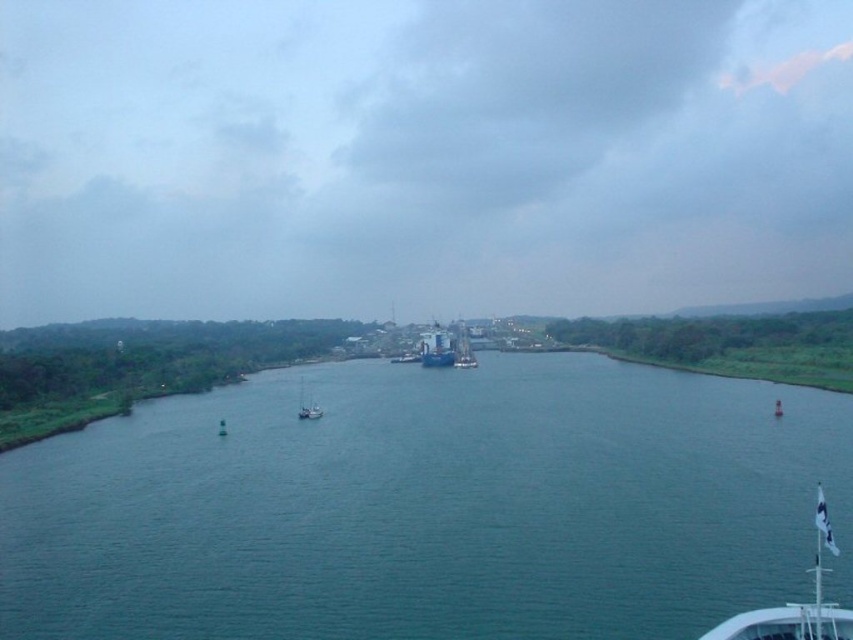
You are on a boat navigating the river and notice the white flag at lower right and the blue matte ship at center. Which object appears taller from your current viewpoint?

The blue matte ship at center appears taller than the white flag at lower right because the white flag at lower right is shorter than the blue matte ship at center according to the description.

You are an observer on the ship and want to compare the widths of the blue matte ship at center and the white matte sailboat at center. Which one is narrower?

The blue matte ship at center is thinner than the white matte sailboat at center, so the blue matte ship at center is narrower.

You are standing on the deck of the ship and want to know how far the point at coordinates (x=750, y=618) is from you. Can you determine the distance?

The point at coordinates (x=750, y=618) is 92.77 feet away from the viewer.